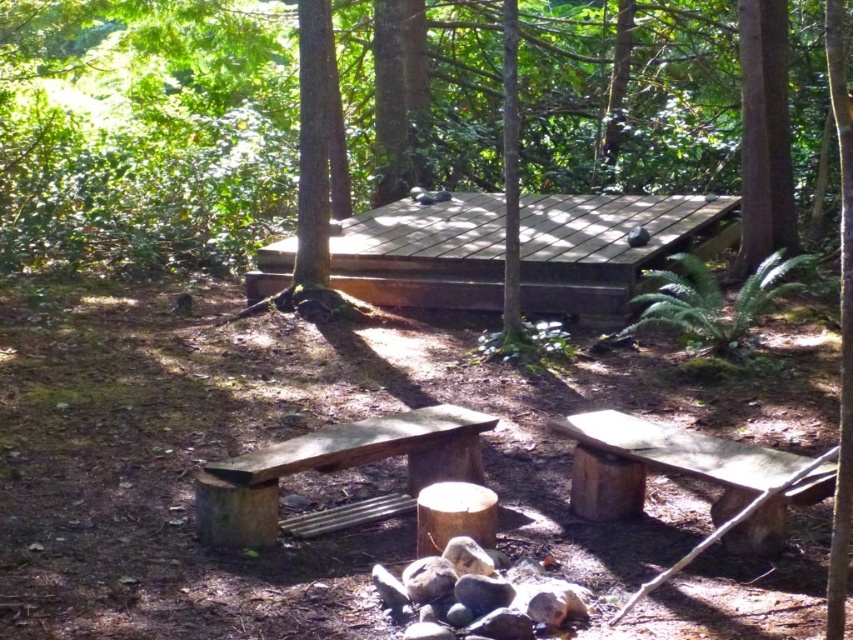
Question: Does wooden bench at lower right have a larger size compared to brown wood bench at center?

Choices:
 (A) no
 (B) yes

Answer: (A)

Question: Which point is closer to the camera?

Choices:
 (A) (363, 522)
 (B) (741, 540)

Answer: (B)

Question: Does wooden bench at lower right have a greater width compared to brown wood bench at center?

Choices:
 (A) no
 (B) yes

Answer: (A)

Question: Which point is closer to the camera?

Choices:
 (A) (776, 467)
 (B) (413, 451)

Answer: (A)

Question: Where is wooden bench at lower right located in relation to brown wood bench at center in the image?

Choices:
 (A) below
 (B) above

Answer: (A)